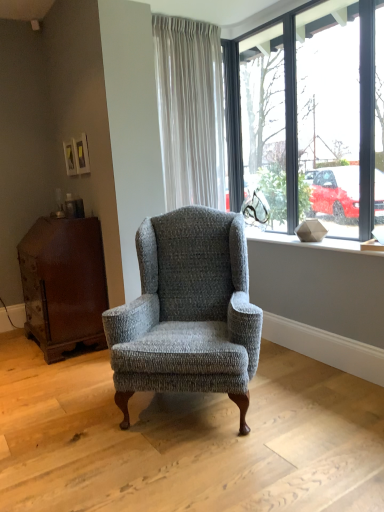
Find the location of a particular element. This screenshot has width=384, height=512. vacant region in front of dark brown wood dresser at left is located at coordinates (52, 372).